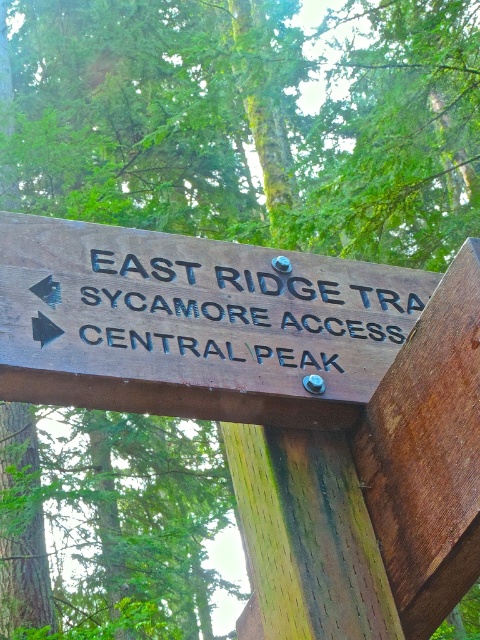
Is brown wooden sign at center in front of black wood sign at center?

Yes, it is.

Does brown wooden sign at center appear on the left side of black wood sign at center?

Yes, brown wooden sign at center is to the left of black wood sign at center.

Which is behind, point (319, 420) or point (121, 330)?

The point (319, 420) is more distant.

Image resolution: width=480 pixels, height=640 pixels. I want to click on brown wooden sign at center, so click(194, 324).